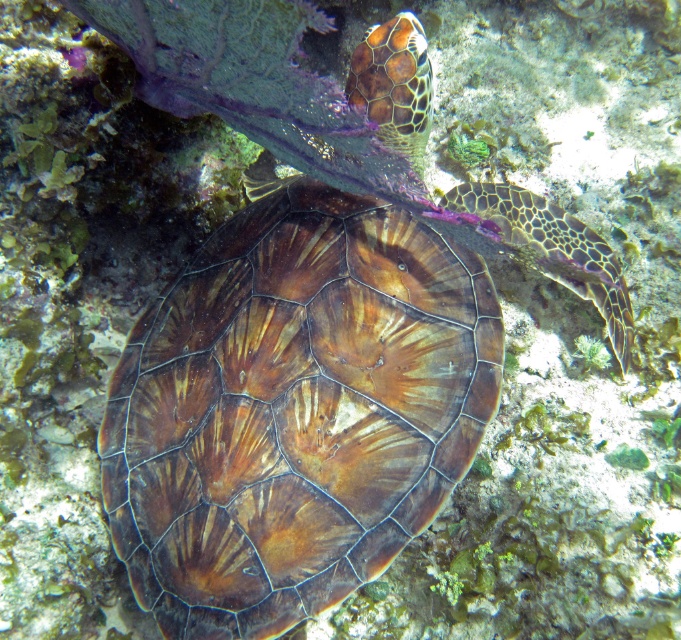
You are a marine biologist observing underwater. You need to take a closeup photo of the leathery brown tortoise at center. Your camera has a maximum focus range of 1.5 meters. Can you take the photo without moving closer?

The distance of leathery brown tortoise at center from camera is 1.56 meters, which is slightly beyond the camera maximum focus range of 1.5 meters. So you need to move closer to take the photo.

You are a marine biologist observing an underwater scene. You notice two shells in the image. The first is a brown leathery shell at center, and the second is a brown textured shell at upper center. Which shell is taller?

The brown leathery shell at center is taller than the brown textured shell at upper center.

You are a marine biologist observing an underwater scene. You notice two shells in the image. The first is a brown leathery shell at center, and the second is a brown textured shell at upper center. Which shell is located lower in the water?

The brown leathery shell at center is positioned under the brown textured shell at upper center, so the brown leathery shell at center is located lower in the water.